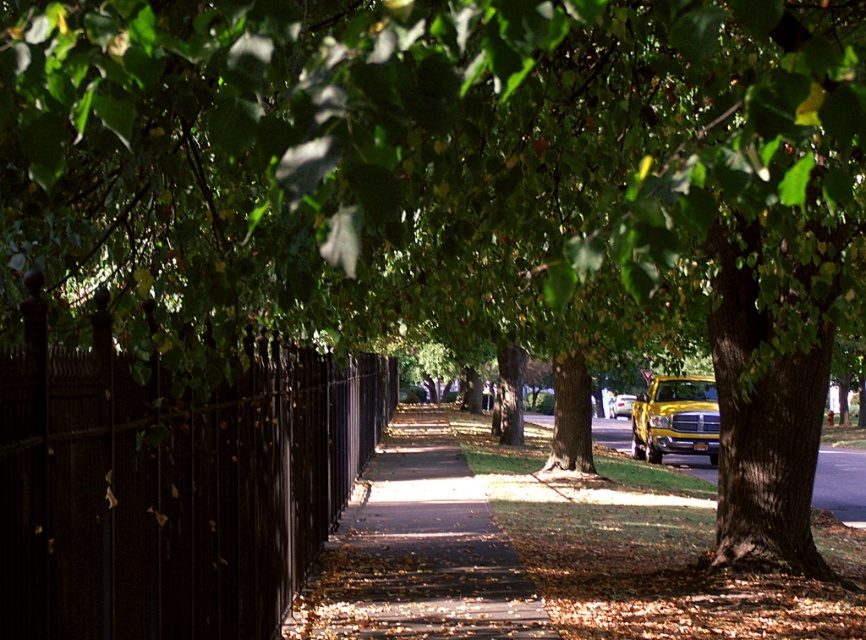
What do you see at coordinates (170, 483) in the screenshot? This screenshot has width=866, height=640. I see `black wrought iron fence at left` at bounding box center [170, 483].

Between point (280, 355) and point (438, 416), which one is positioned behind?

The point (438, 416) is more distant.

Image resolution: width=866 pixels, height=640 pixels. What do you see at coordinates (170, 483) in the screenshot?
I see `black wrought iron fence at left` at bounding box center [170, 483].

I want to click on black wrought iron fence at left, so click(170, 483).

Is yellow matte truck at right wider than yellow metallic truck at center?

Yes.

Is yellow matte truck at right taller than yellow metallic truck at center?

Correct, yellow matte truck at right is much taller as yellow metallic truck at center.

At what (x,y) coordinates should I click in order to perform the action: click on yellow matte truck at right. Please return your answer as a coordinate pair (x, y). This screenshot has width=866, height=640. Looking at the image, I should click on (675, 419).

This screenshot has width=866, height=640. What are the coordinates of `yellow matte truck at right` in the screenshot? It's located at (675, 419).

Is yellow matte truck at right positioned behind yellow matte truck at center?

Yes, it is.

I want to click on yellow matte truck at right, so click(675, 419).

At what (x,y) coordinates should I click in order to perform the action: click on yellow matte truck at right. Please return your answer as a coordinate pair (x, y). Image resolution: width=866 pixels, height=640 pixels. Looking at the image, I should click on (675, 419).